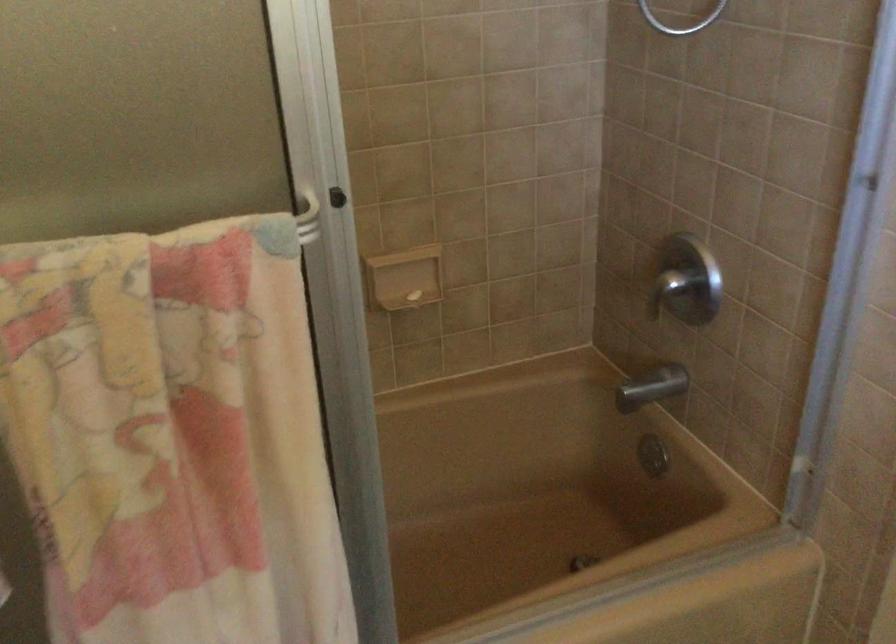
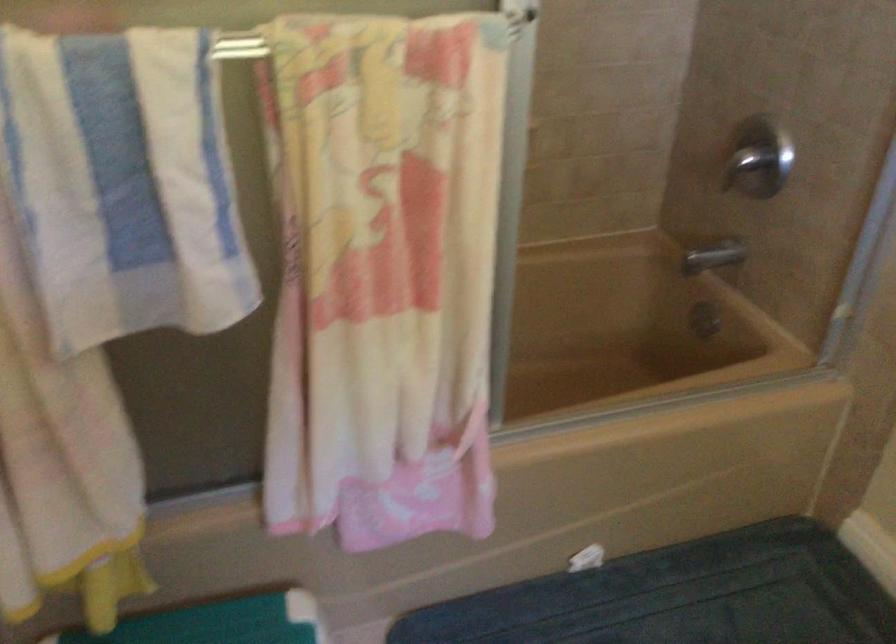
Question: The first image is from the beginning of the video and the second image is from the end. How did the camera likely rotate when shooting the video?

Choices:
 (A) Left
 (B) Right
 (C) Up
 (D) Down

Answer: (D)